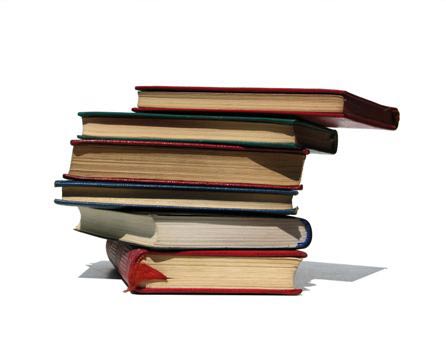
Where is `books`? This screenshot has width=446, height=346. books is located at coordinates (218, 95), (179, 129), (170, 161), (160, 197), (159, 233), (152, 270).